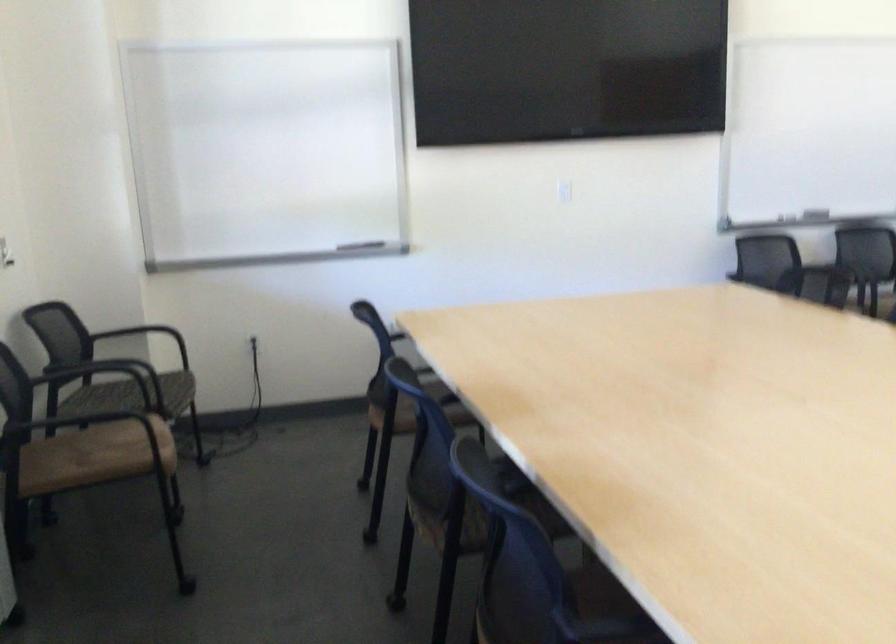
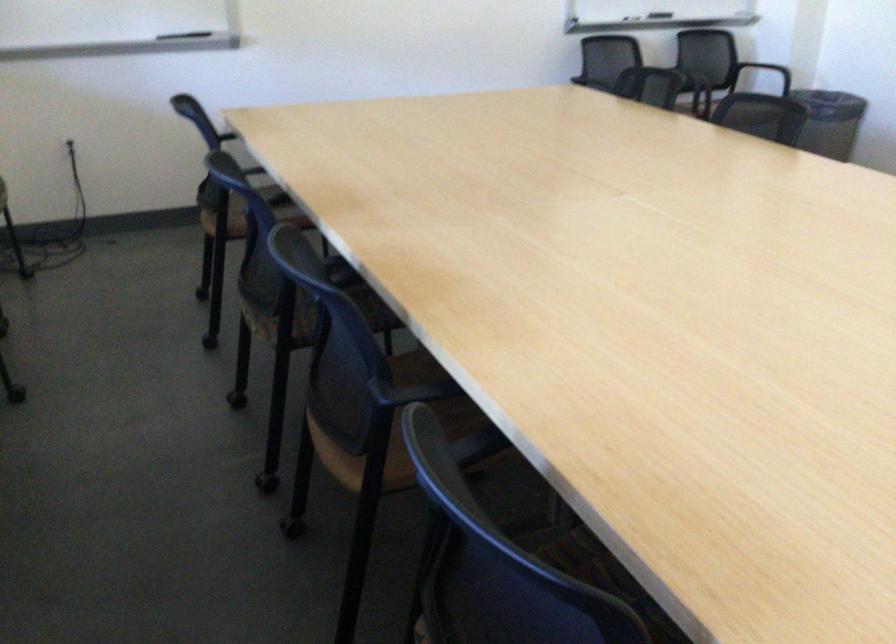
In the second image, find the point that corresponds to (416,362) in the first image.

(253, 169)